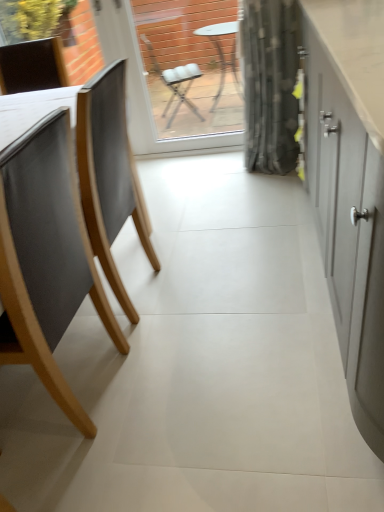
Question: Is matte wood chair at left wider than transparent glass window screen at center?

Choices:
 (A) yes
 (B) no

Answer: (A)

Question: Considering the relative sizes of matte wood chair at left and transparent glass window screen at center in the image provided, is matte wood chair at left thinner than transparent glass window screen at center?

Choices:
 (A) no
 (B) yes

Answer: (A)

Question: From the image's perspective, is matte wood chair at left under transparent glass window screen at center?

Choices:
 (A) yes
 (B) no

Answer: (A)

Question: Is the position of matte wood chair at left less distant than that of transparent glass window screen at center?

Choices:
 (A) yes
 (B) no

Answer: (A)

Question: Considering the relative positions of matte wood chair at left and transparent glass window screen at center in the image provided, is matte wood chair at left to the left of transparent glass window screen at center from the viewer's perspective?

Choices:
 (A) yes
 (B) no

Answer: (A)

Question: From a real-world perspective, is matte wood chair at left physically located above or below matte gray cabinet at right?

Choices:
 (A) above
 (B) below

Answer: (B)

Question: Looking at their shapes, would you say matte wood chair at left is wider or thinner than matte gray cabinet at right?

Choices:
 (A) wide
 (B) thin

Answer: (B)

Question: Based on their positions, is matte wood chair at left located to the left or right of matte gray cabinet at right?

Choices:
 (A) right
 (B) left

Answer: (B)

Question: From their relative heights in the image, would you say matte wood chair at left is taller or shorter than matte gray cabinet at right?

Choices:
 (A) tall
 (B) short

Answer: (B)

Question: Considering the positions of transparent glass window screen at center and matte gray cabinet at right in the image, is transparent glass window screen at center wider or thinner than matte gray cabinet at right?

Choices:
 (A) thin
 (B) wide

Answer: (A)

Question: From a real-world perspective, relative to matte gray cabinet at right, is transparent glass window screen at center vertically above or below?

Choices:
 (A) above
 (B) below

Answer: (A)

Question: Is transparent glass window screen at center to the left or to the right of matte gray cabinet at right in the image?

Choices:
 (A) right
 (B) left

Answer: (B)

Question: Considering the positions of point (162, 54) and point (337, 183), is point (162, 54) closer or farther from the camera than point (337, 183)?

Choices:
 (A) closer
 (B) farther

Answer: (B)

Question: Relative to matte wood chair at left, is matte gray cabinet at right in front or behind?

Choices:
 (A) behind
 (B) front

Answer: (B)

Question: In the image, is matte gray cabinet at right on the left side or the right side of matte wood chair at left?

Choices:
 (A) right
 (B) left

Answer: (A)